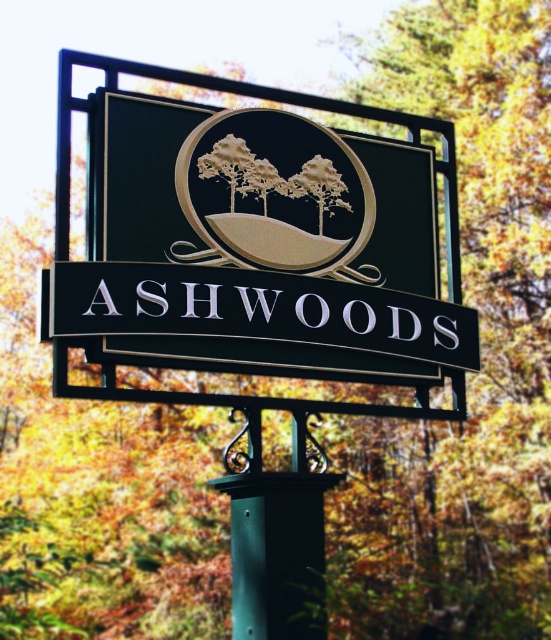
You are a hiker who just arrived at the signpost. You notice two gold elements on the sign. Which one is positioned lower between the metallic gold sign at center and the matte gold emblem at center?

The metallic gold sign at center is positioned lower than the matte gold emblem at center.

You are an artist trying to sketch the scene. You need to decide which object to draw first based on their sizes. Which one should you start with, the metallic gold sign at center or the matte gold emblem at center?

The metallic gold sign at center might be wider than matte gold emblem at center, so you should start with the metallic gold sign at center as it is likely larger.